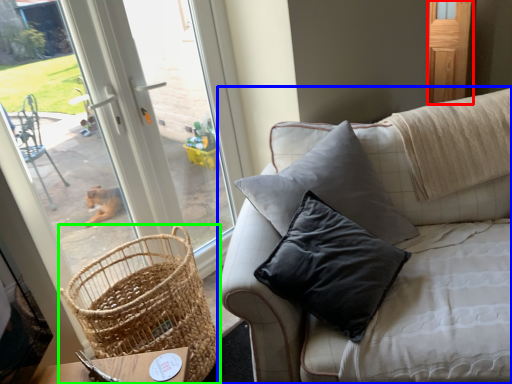
Question: Estimate the real-world distances between objects in this image. Which object is closer to screen door (highlighted by a red box), studio couch (highlighted by a blue box) or picnic basket (highlighted by a green box)?

Choices:
 (A) studio couch
 (B) picnic basket

Answer: (A)